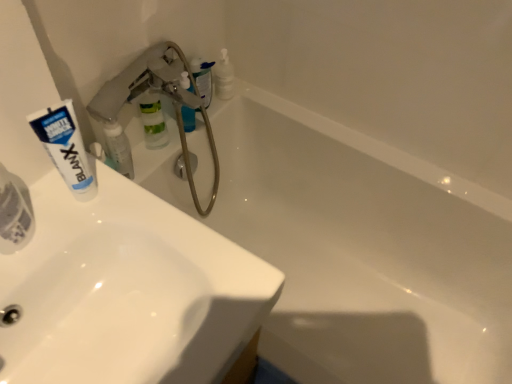
Question: Does translucent plastic bottle at upper center, placed as the 4th toiletry when sorted from front to back, appear on the left side of translucent plastic toothpaste tube at left, placed as the fourth toiletry when sorted from back to front?

Choices:
 (A) yes
 (B) no

Answer: (B)

Question: Does translucent plastic bottle at upper center, placed as the 4th toiletry when sorted from front to back, have a larger size compared to translucent plastic toothpaste tube at left, placed as the fourth toiletry when sorted from back to front?

Choices:
 (A) yes
 (B) no

Answer: (A)

Question: Is translucent plastic bottle at upper center, placed as the 4th toiletry when sorted from front to back, closer to camera compared to translucent plastic toothpaste tube at left, placed as the fourth toiletry when sorted from back to front?

Choices:
 (A) no
 (B) yes

Answer: (A)

Question: Would you consider translucent plastic bottle at upper center, placed as the 4th toiletry when sorted from front to back, to be distant from translucent plastic toothpaste tube at left, placed as the fourth toiletry when sorted from back to front?

Choices:
 (A) no
 (B) yes

Answer: (A)

Question: From the image's perspective, is translucent plastic bottle at upper center, placed as the 4th toiletry when sorted from front to back, beneath translucent plastic toothpaste tube at left, placed as the fourth toiletry when sorted from back to front?

Choices:
 (A) yes
 (B) no

Answer: (B)

Question: Is translucent plastic bottle at upper center, which is counted as the 1th toiletry, starting from the back, thinner than translucent plastic toothpaste tube at left, placed as the fourth toiletry when sorted from back to front?

Choices:
 (A) no
 (B) yes

Answer: (A)

Question: Are translucent plastic soap dispenser at upper center, which is the third toiletry in front-to-back order, and white glossy sink at upper left, the 2th sink positioned from the back, located far from each other?

Choices:
 (A) yes
 (B) no

Answer: (B)

Question: Can you confirm if translucent plastic soap dispenser at upper center, which ranks as the 2th toiletry in back-to-front order, is thinner than white glossy sink at upper left, which is counted as the first sink, starting from the front?

Choices:
 (A) no
 (B) yes

Answer: (B)

Question: Does translucent plastic soap dispenser at upper center, which ranks as the 2th toiletry in back-to-front order, have a smaller size compared to white glossy sink at upper left, which is counted as the first sink, starting from the front?

Choices:
 (A) no
 (B) yes

Answer: (B)

Question: From the image's perspective, is translucent plastic soap dispenser at upper center, which ranks as the 2th toiletry in back-to-front order, over white glossy sink at upper left, the 2th sink positioned from the back?

Choices:
 (A) no
 (B) yes

Answer: (B)

Question: Is translucent plastic soap dispenser at upper center, which ranks as the 2th toiletry in back-to-front order, shorter than white glossy sink at upper left, which is counted as the first sink, starting from the front?

Choices:
 (A) no
 (B) yes

Answer: (A)

Question: Is translucent plastic soap dispenser at upper center, which ranks as the 2th toiletry in back-to-front order, with white glossy sink at upper left, which is counted as the first sink, starting from the front?

Choices:
 (A) yes
 (B) no

Answer: (B)

Question: Is translucent plastic bottle at upper center, placed as the 4th toiletry when sorted from front to back, next to white matte tube at upper left and touching it?

Choices:
 (A) no
 (B) yes

Answer: (A)